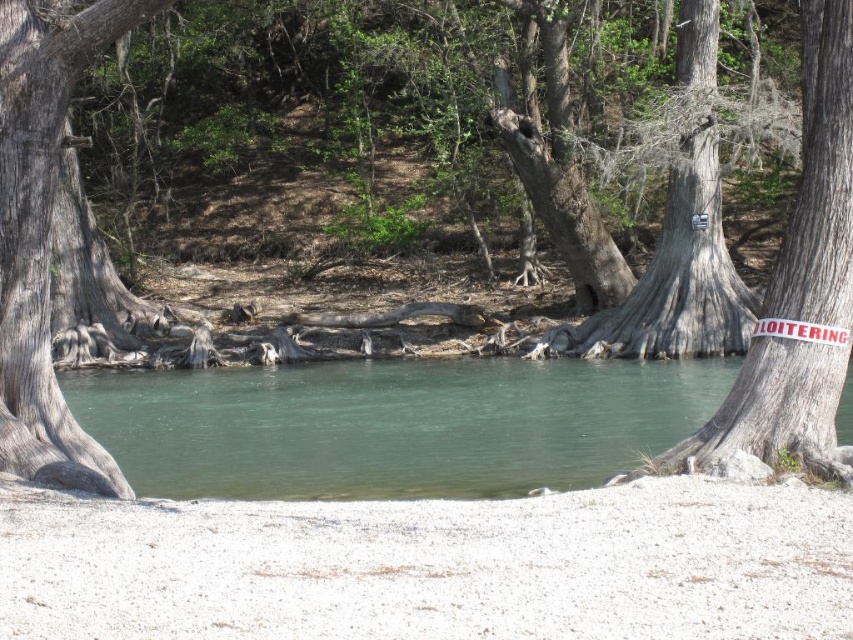
Can you confirm if gray rough tree trunk at center right is bigger than gray rough bark tree trunk at left?

Indeed, gray rough tree trunk at center right has a larger size compared to gray rough bark tree trunk at left.

Who is lower down, gray rough tree trunk at center right or gray rough bark tree trunk at left?

gray rough tree trunk at center right is lower down.

The width and height of the screenshot is (853, 640). What are the coordinates of `gray rough tree trunk at center right` in the screenshot? It's located at (820, 179).

Does clear water at center have a greater width compared to gray rough bark tree trunk at left?

Yes.

I want to click on clear water at center, so click(393, 424).

Is clear water at center positioned at the back of gray rough tree trunk at center right?

That is True.

In the scene shown: Who is higher up, clear water at center or gray rough tree trunk at center right?

gray rough tree trunk at center right

Consider the image. Measure the distance between clear water at center and camera.

clear water at center is 42.01 feet away from camera.

At what (x,y) coordinates should I click in order to perform the action: click on clear water at center. Please return your answer as a coordinate pair (x, y). The width and height of the screenshot is (853, 640). Looking at the image, I should click on (393, 424).